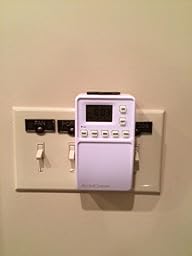
Identify the location of black bar on top of plastic box. (105, 93).